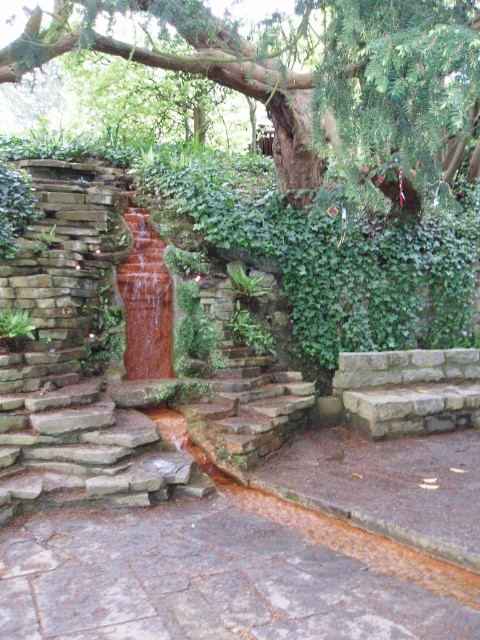
Question: Among these objects, which one is nearest to the camera?

Choices:
 (A) translucent amber water at center
 (B) brown stone stairs at center
 (C) brown stone path at center
 (D) green leafy tree at upper center

Answer: (C)

Question: Where is brown stone path at center located in relation to brown stone stairs at center in the image?

Choices:
 (A) left
 (B) right

Answer: (A)

Question: Estimate the real-world distances between objects in this image. Which object is farther from the brown stone path at center?

Choices:
 (A) brown stone stairs at center
 (B) translucent amber water at center
 (C) green leafy tree at upper center

Answer: (C)

Question: Based on their relative distances, which object is farther from the green leafy tree at upper center?

Choices:
 (A) brown stone path at center
 (B) brown stone stairs at center

Answer: (A)

Question: Is the position of brown stone stairs at center more distant than that of translucent amber water at center?

Choices:
 (A) yes
 (B) no

Answer: (B)

Question: Can you confirm if green leafy tree at upper center is wider than brown stone stairs at center?

Choices:
 (A) no
 (B) yes

Answer: (B)